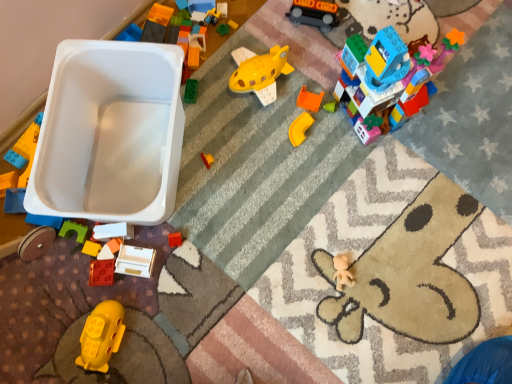
Find the location of a particular element. empty space that is to the right of rubber brick at lower left, positioned as the seventh toy in right-to-left order is located at coordinates (169, 280).